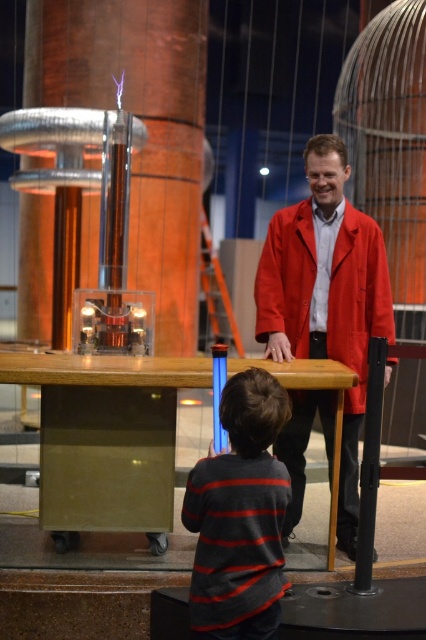
You are a museum visitor standing in the science exhibit. You see the wooden table at center and the striped sweater at center. Which object is closer to the ceiling?

The wooden table at center is located above the striped sweater at center, so it is closer to the ceiling.

You are a parent trying to ensure your child is safe while they interact with the wooden table at center and the striped sweater at center. Based on the scene, which object is higher and might pose a risk if the child tries to climb onto it?

The wooden table at center has a greater height compared to the striped sweater at center, so the wooden table at center is higher and could pose a climbing risk.